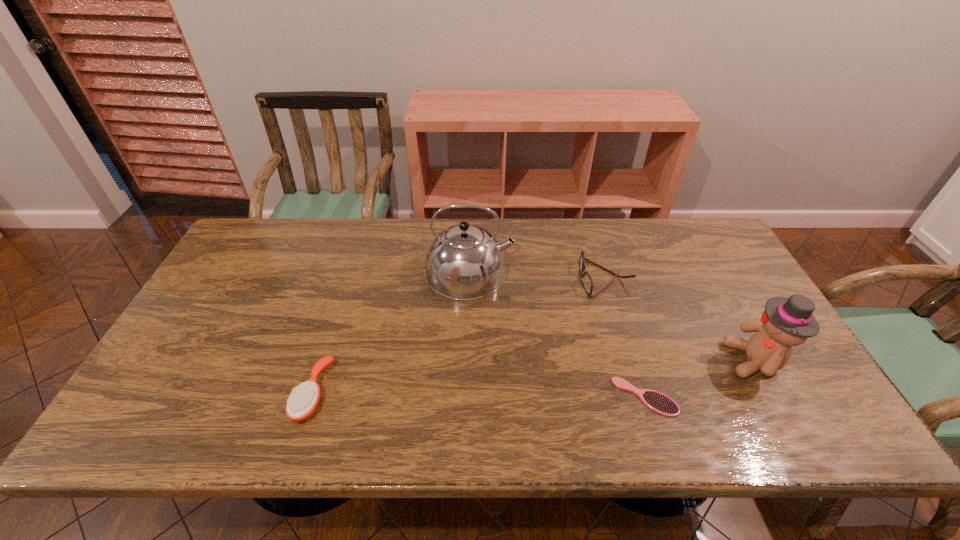
Locate an element on the screen. vacant space that is in between the spectacles and the taller hairbrush is located at coordinates (459, 335).

You are a GUI agent. You are given a task and a screenshot of the screen. Output one action in this format:
    pyautogui.click(x=<x>, y=<y>)
    Task: Click on the vacant region between the spectacles and the taller hairbrush
    The width and height of the screenshot is (960, 540).
    Given the screenshot: What is the action you would take?
    (459, 335)

This screenshot has height=540, width=960. I want to click on object that is the second closest one to the second tallest object, so click(587, 282).

Locate an element on the screen. This screenshot has width=960, height=540. object identified as the closest to the rag_doll is located at coordinates (658, 402).

Locate an element on the screen. The width and height of the screenshot is (960, 540). vacant area in the image that satisfies the following two spatial constraints: 1. on the front-facing side of the shorter hairbrush; 2. on the left side of the spectacles is located at coordinates (640, 397).

Locate an element on the screen. vacant position in the image that satisfies the following two spatial constraints: 1. on the front-facing side of the rightmost object; 2. on the front side of the shorter hairbrush is located at coordinates (776, 397).

The image size is (960, 540). In order to click on free point that satisfies the following two spatial constraints: 1. on the back side of the right hairbrush; 2. from the spout of the fourth object from right to left in this screenshot , I will do `click(606, 272)`.

Locate an element on the screen. vacant space that satisfies the following two spatial constraints: 1. from the spout of the fourth object from right to left; 2. on the left side of the shortest object is located at coordinates (x=467, y=397).

This screenshot has height=540, width=960. I want to click on free spot that satisfies the following two spatial constraints: 1. on the back side of the shortest object; 2. from the spout of the second object from left to right, so click(x=606, y=272).

I want to click on vacant point that satisfies the following two spatial constraints: 1. on the front-facing side of the rightmost object; 2. on the front side of the taller hairbrush, so pyautogui.click(x=774, y=393).